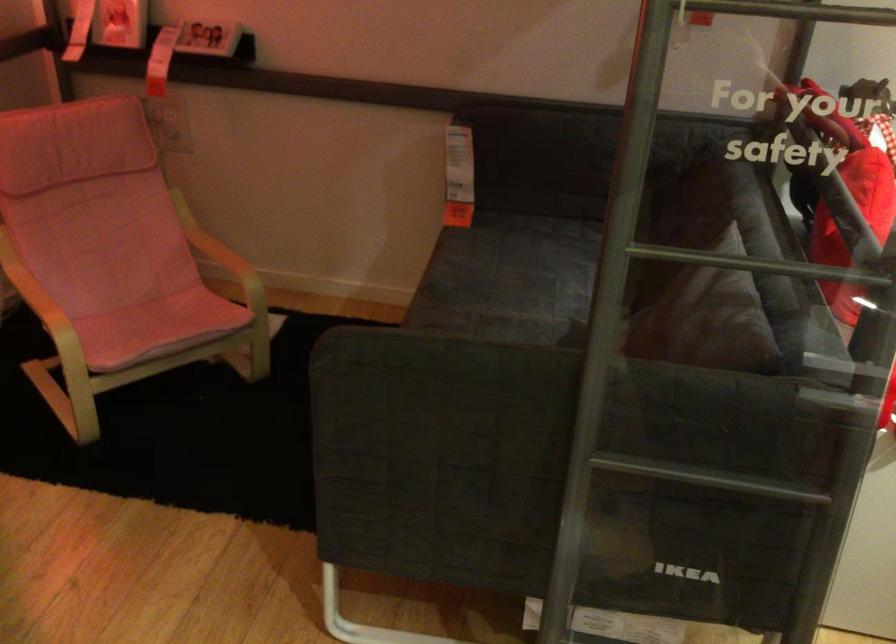
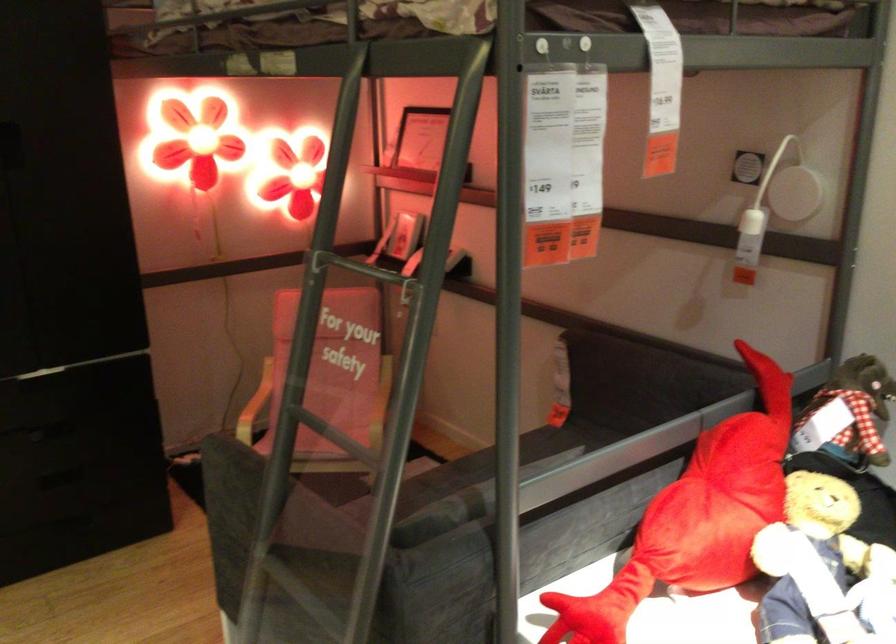
Locate, in the second image, the point that corresponds to (503,230) in the first image.

(567, 437)